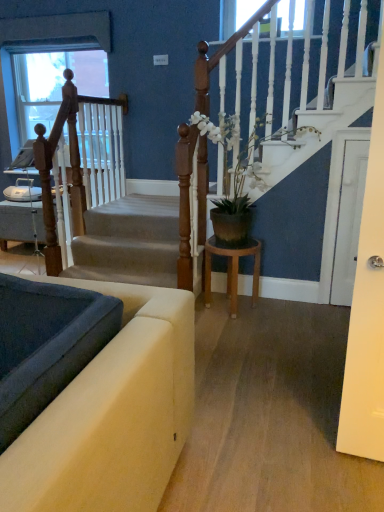
This screenshot has height=512, width=384. I want to click on free space in front of white glossy door at right, so click(338, 312).